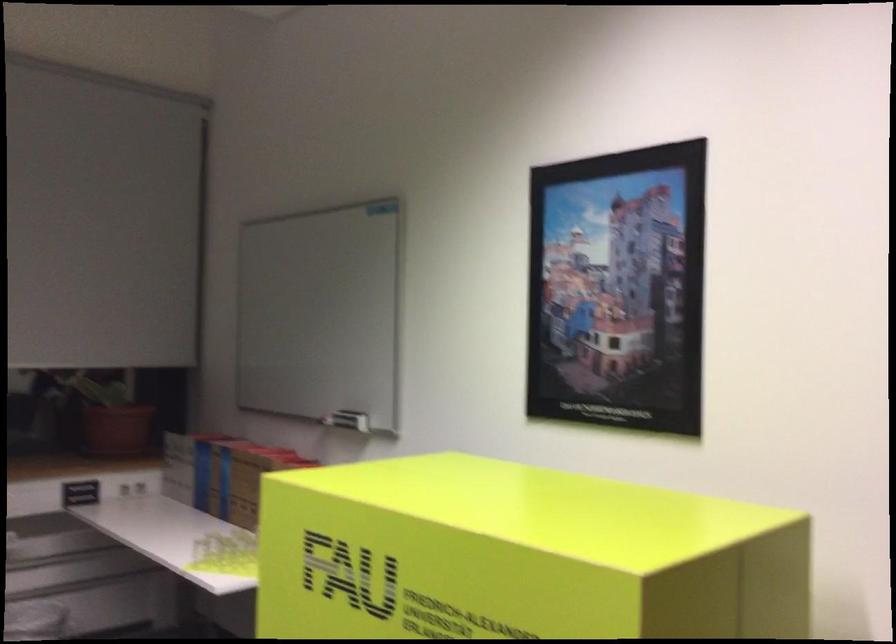
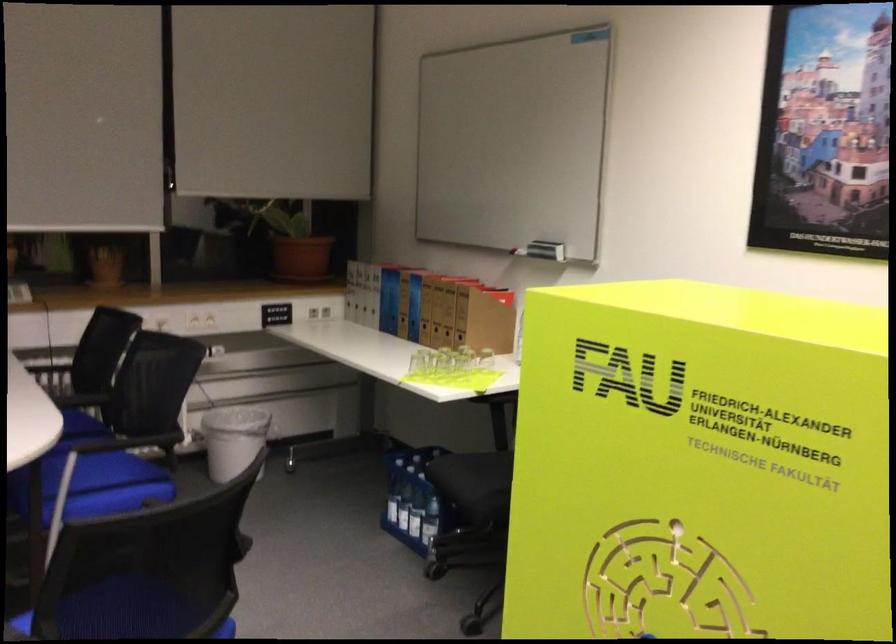
In the second image, find the point that corresponds to point (349, 420) in the first image.

(546, 250)